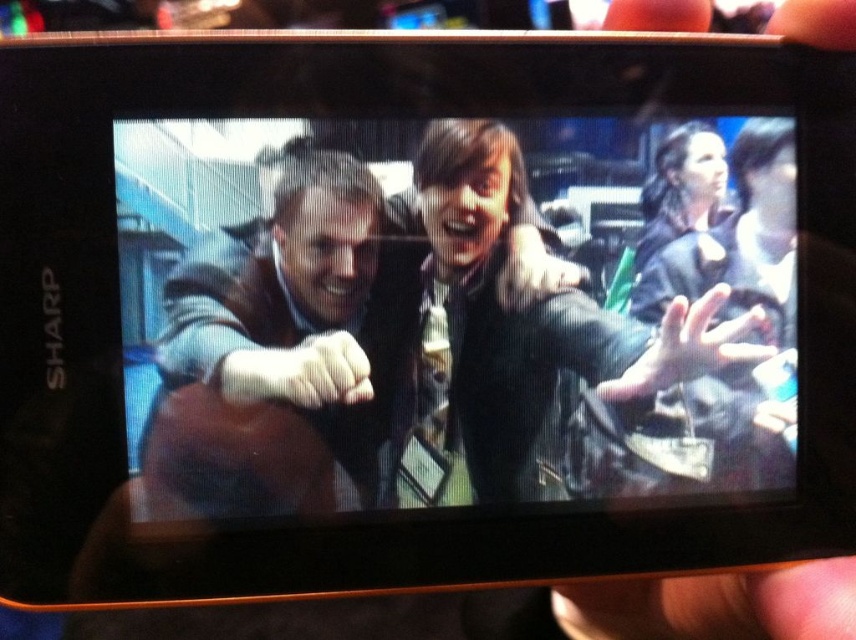
Question: Considering the real-world distances, which object is closest to the smooth black hair at upper right?

Choices:
 (A) smooth leather hand at center right
 (B) flesh-toned skin at lower right

Answer: (A)

Question: Can you confirm if smooth leather hand at center right is thinner than smooth black hair at upper right?

Choices:
 (A) yes
 (B) no

Answer: (B)

Question: Which of the following is the farthest from the observer?

Choices:
 (A) tap(842, 598)
 (B) tap(639, 385)

Answer: (B)

Question: Can you confirm if flesh-toned skin at lower right is positioned above smooth leather hand at center right?

Choices:
 (A) no
 (B) yes

Answer: (A)

Question: Which point is farther to the camera?

Choices:
 (A) flesh-toned skin at lower right
 (B) smooth leather hand at center right
 (C) smooth black hair at upper right

Answer: (B)

Question: Does smooth leather hand at center right appear over smooth black hair at upper right?

Choices:
 (A) no
 (B) yes

Answer: (A)